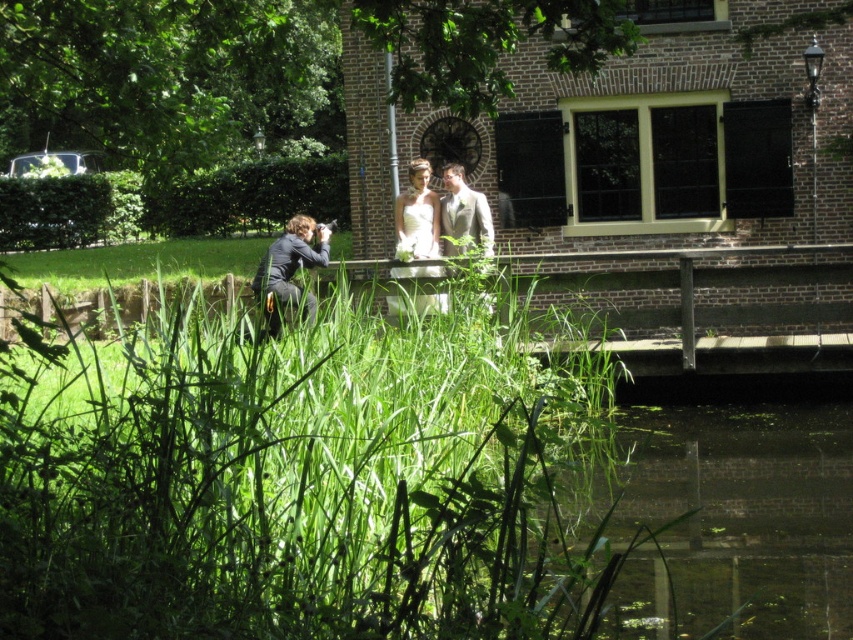
Question: Among these objects, which one is farthest from the camera?

Choices:
 (A) green leafy grass at lower center
 (B) matte black suit at lower left

Answer: (B)

Question: Does green leafy grass at lower center come in front of matte black suit at lower left?

Choices:
 (A) yes
 (B) no

Answer: (A)

Question: Is white satin dress at upper center wider than matte black suit at lower left?

Choices:
 (A) no
 (B) yes

Answer: (B)

Question: Which object is positioned farthest from the green leafy grass at lower center?

Choices:
 (A) matte black suit at lower left
 (B) light beige textured suit at center
 (C) white satin dress at upper center

Answer: (A)

Question: Can you confirm if matte black suit at lower left is thinner than light beige textured suit at center?

Choices:
 (A) no
 (B) yes

Answer: (B)

Question: Which of the following is the closest to the observer?

Choices:
 (A) matte black suit at lower left
 (B) light beige textured suit at center

Answer: (B)